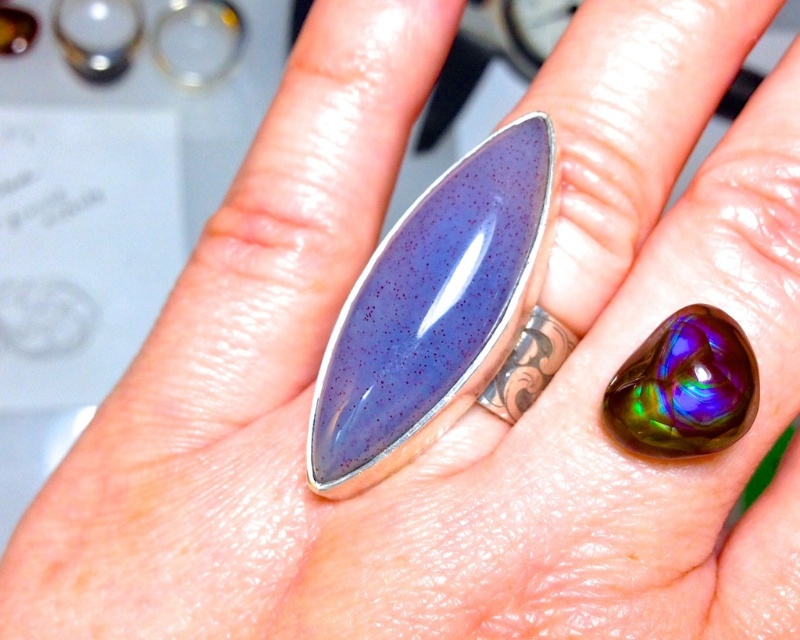
Where is `purple glossy ring at center`? The image size is (800, 640). purple glossy ring at center is located at coordinates (433, 310).

You are a GUI agent. You are given a task and a screenshot of the screen. Output one action in this format:
    pyautogui.click(x=<x>, y=<y>)
    Task: Click on the purple glossy ring at center
    The width and height of the screenshot is (800, 640).
    Given the screenshot: What is the action you would take?
    433,310